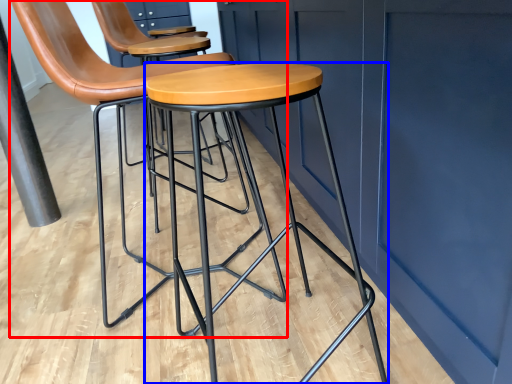
Question: Which point is closer to the camera, chair (highlighted by a red box) or stool (highlighted by a blue box)?

Choices:
 (A) chair
 (B) stool

Answer: (B)